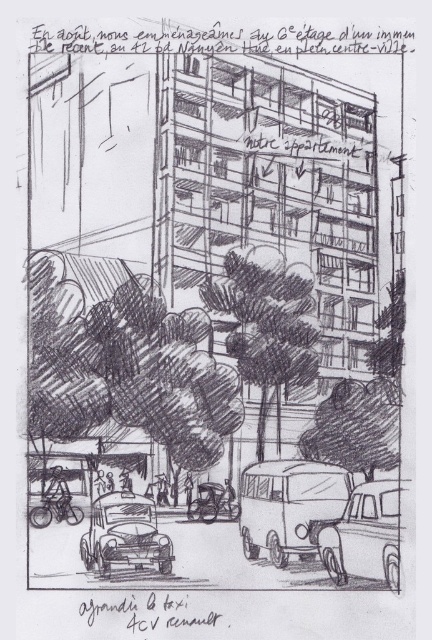
The image size is (432, 640). In order to click on charcoal textured tree at center in this screenshot , I will do pyautogui.click(x=266, y=332).

Is point (291, 520) farther from viewer compared to point (82, 545)?

No, (291, 520) is in front of (82, 545).

Can you confirm if matte gray van at center is thinner than matte black taxi at lower left?

Indeed, matte gray van at center has a lesser width compared to matte black taxi at lower left.

Identify the location of matte gray van at center. click(x=294, y=512).

Where is `matte gray van at center`? This screenshot has height=640, width=432. matte gray van at center is located at coordinates (294, 512).

Who is lower down, shiny silver sedan at center or matte black taxi at lower left?

matte black taxi at lower left is below.

Find the location of a particular element. This screenshot has width=432, height=640. shiny silver sedan at center is located at coordinates 365,534.

I want to click on shiny silver sedan at center, so click(x=365, y=534).